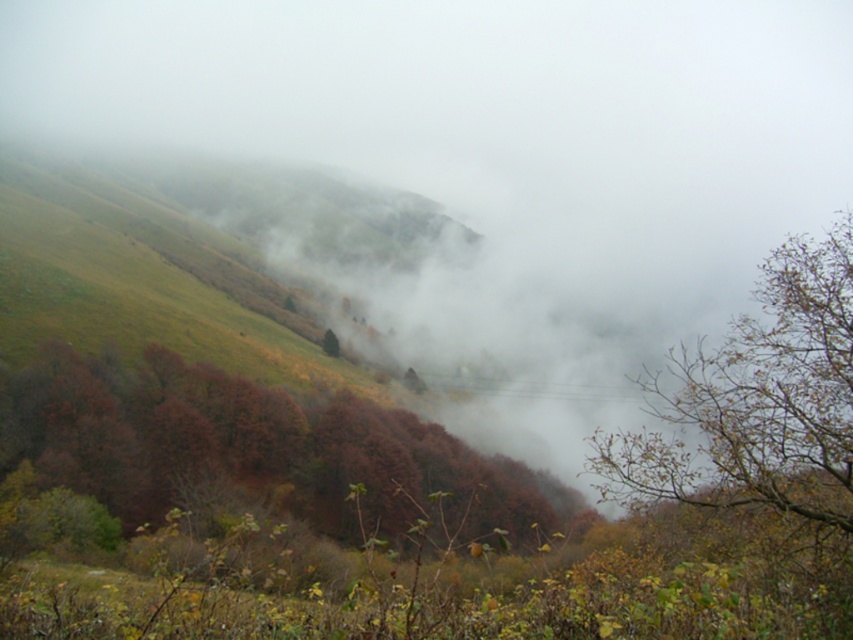
Question: Can you confirm if autumn leaves at center is positioned to the right of brown leafy branches at right?

Choices:
 (A) yes
 (B) no

Answer: (B)

Question: Among these objects, which one is farthest from the camera?

Choices:
 (A) brown leafy branches at right
 (B) autumn leaves at center
 (C) green matte tree at center

Answer: (C)

Question: Which object appears closest to the camera in this image?

Choices:
 (A) brown leafy branches at right
 (B) green matte tree at center
 (C) autumn leaves at center

Answer: (A)

Question: Is autumn leaves at center further to camera compared to brown leafy branches at right?

Choices:
 (A) no
 (B) yes

Answer: (B)

Question: Which point is closer to the camera?

Choices:
 (A) brown leafy branches at right
 (B) green matte tree at center
 (C) autumn leaves at center

Answer: (A)

Question: Is brown leafy branches at right thinner than green matte tree at center?

Choices:
 (A) yes
 (B) no

Answer: (B)